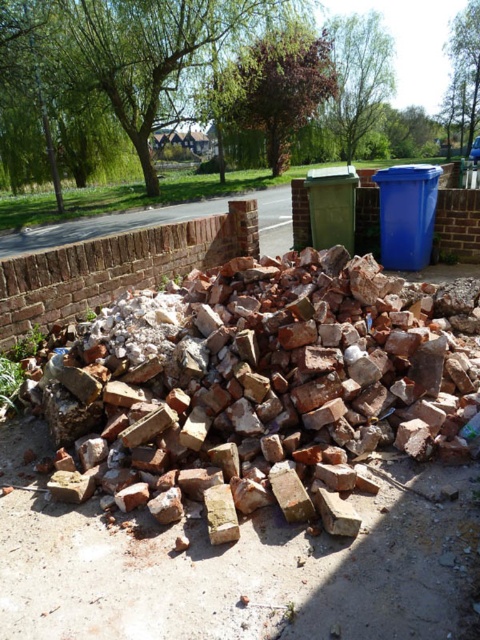
Question: Which object appears farthest from the camera in this image?

Choices:
 (A) brown rough bricks at center
 (B) green plastic bin at center

Answer: (B)

Question: Does brown rough bricks at center have a larger size compared to green plastic bin at center?

Choices:
 (A) no
 (B) yes

Answer: (B)

Question: Which object is positioned closest to the green plastic bin at center?

Choices:
 (A) brown rough bricks at center
 (B) blue plastic bin at right

Answer: (B)

Question: Is brown rough bricks at center to the left of blue plastic bin at right from the viewer's perspective?

Choices:
 (A) no
 (B) yes

Answer: (B)

Question: Among these objects, which one is farthest from the camera?

Choices:
 (A) brown rough bricks at center
 (B) blue plastic bin at right

Answer: (B)

Question: Is brown rough bricks at center bigger than blue plastic bin at right?

Choices:
 (A) no
 (B) yes

Answer: (B)